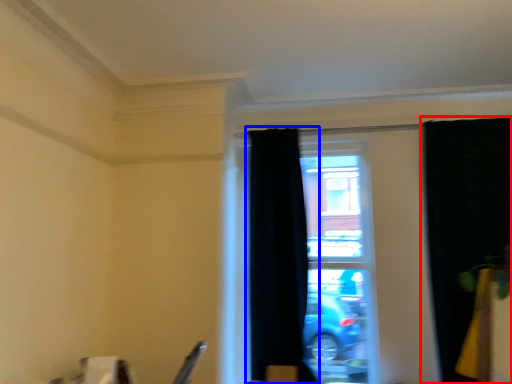
Question: Which object is further to the camera taking this photo, curtain (highlighted by a red box) or curtain (highlighted by a blue box)?

Choices:
 (A) curtain
 (B) curtain

Answer: (B)